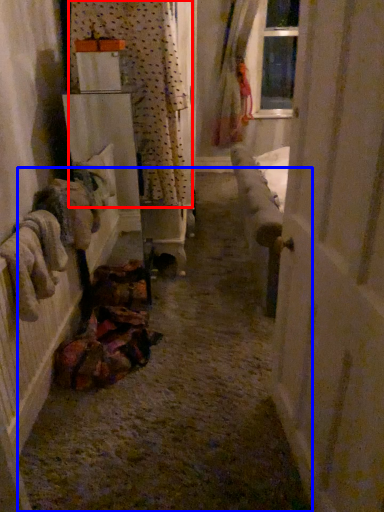
Question: Which point is further to the camera, curtain (highlighted by a red box) or path (highlighted by a blue box)?

Choices:
 (A) curtain
 (B) path

Answer: (A)